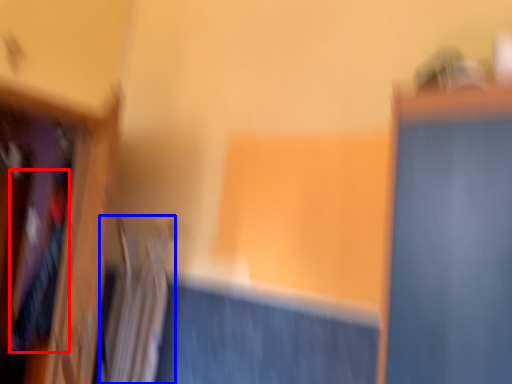
Question: Which of the following is the closest to the observer, clothing (highlighted by a red box) or radiator (highlighted by a blue box)?

Choices:
 (A) clothing
 (B) radiator

Answer: (B)